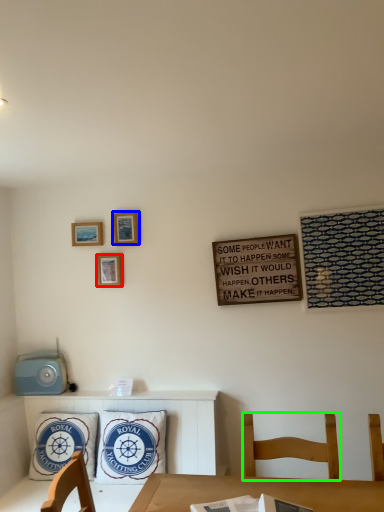
Question: Which object is positioned farthest from picture frame (highlighted by a red box)? Select from picture frame (highlighted by a blue box) and chair (highlighted by a green box).

Choices:
 (A) picture frame
 (B) chair

Answer: (B)